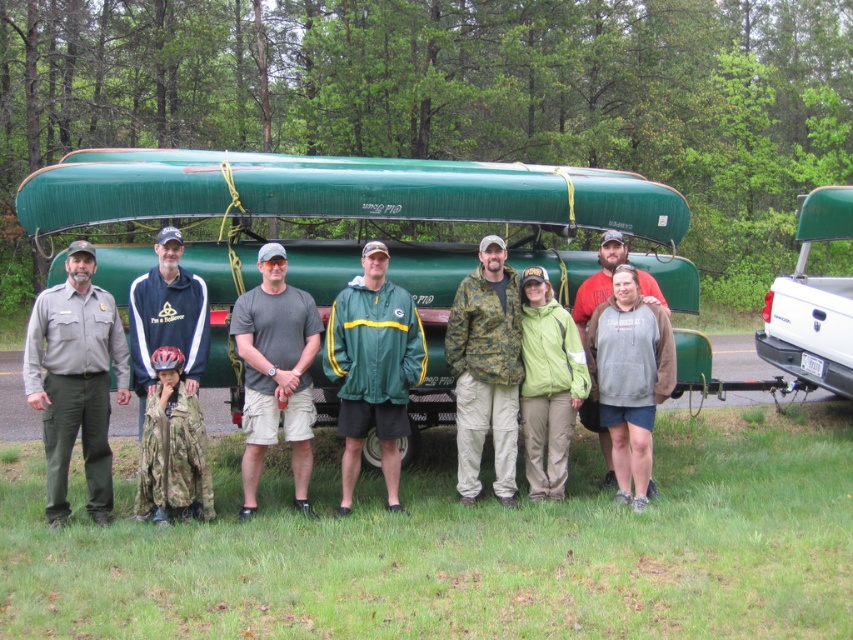
Question: Which object appears farthest from the camera in this image?

Choices:
 (A) green matte boat at center
 (B) gray cotton t-shirt at center
 (C) green matte jacket at center

Answer: (A)

Question: Is the position of green matte jacket at center more distant than that of gray cotton t-shirt at center?

Choices:
 (A) no
 (B) yes

Answer: (B)

Question: Which object is positioned farthest from the white matte truck at upper right?

Choices:
 (A) green matte boat at center
 (B) green matte jacket at center
 (C) camouflage jacket at center
 (D) gray fleece sweatshirt at center

Answer: (B)

Question: Is green matte jacket at center below white matte truck at upper right?

Choices:
 (A) no
 (B) yes

Answer: (B)

Question: Does green matte jacket at center appear on the right side of camouflage jacket at center?

Choices:
 (A) yes
 (B) no

Answer: (B)

Question: Which point is farther from the camera taking this photo?

Choices:
 (A) (640, 275)
 (B) (413, 298)
 (C) (207, 349)
 (D) (363, 321)

Answer: (A)